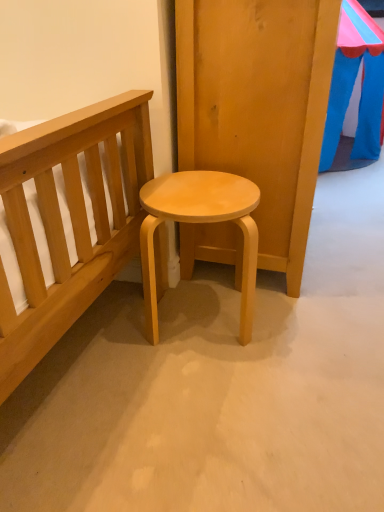
Where is `light wood stool at center`? Image resolution: width=384 pixels, height=512 pixels. light wood stool at center is located at coordinates (200, 223).

What do you see at coordinates (200, 223) in the screenshot?
I see `light wood stool at center` at bounding box center [200, 223].

This screenshot has width=384, height=512. What are the coordinates of `light wood stool at center` in the screenshot? It's located at (200, 223).